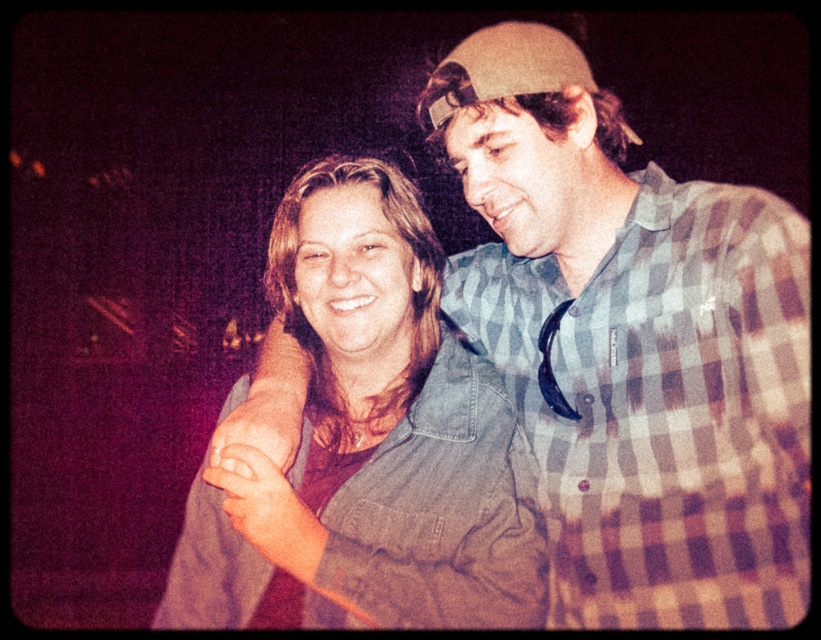
You are organizing a clothing donation drive and need to categorize the checkered flannel shirt at upper right and the denim jacket at center based on their sizes. Which one should be placed in the large size section?

The checkered flannel shirt at upper right is bigger than the denim jacket at center, so it should be placed in the large size section.

Based on the scene description, can you determine the relative positions of the checkered flannel shirt at upper right and the denim jacket at center? Please explain using their spatial relationship.

The checkered flannel shirt at upper right is positioned to the right of the denim jacket at center, meaning it is located further to the right side of the image compared to the denim jacket at center.

You are standing in the same room as the scene and want to hand a drink to the person wearing the checkered flannel shirt at upper right. Based on their position, which direction should you move to approach them?

The checkered flannel shirt at upper right is located at point (664, 406), which is in the upper right area of the scene. To approach them, you should move towards the upper right direction from your current position.